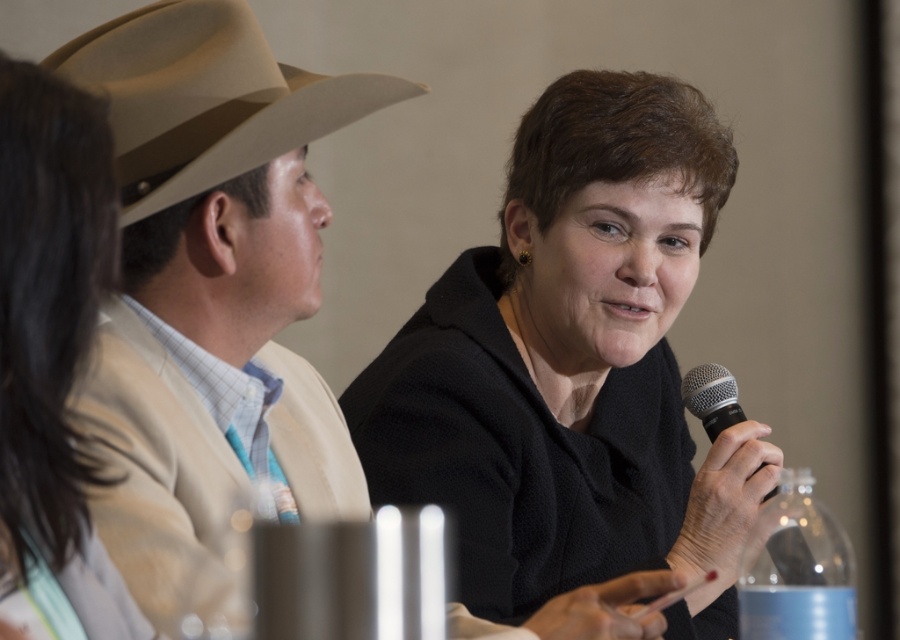
You are organizing a panel discussion and need to place a name tag on the table in front of the black matte jacket at center. The table is represented by the coordinates from point A at lower left corner to point B at lower right corner. The coordinates of the black matte jacket at center are given as point C at [573,365]. Where should you place the name tag so it is directly in front of the black matte jacket at center?

Place the name tag at the coordinates corresponding to point C at [573,365] since that is where the black matte jacket at center is located, ensuring the name tag is directly in front of them.